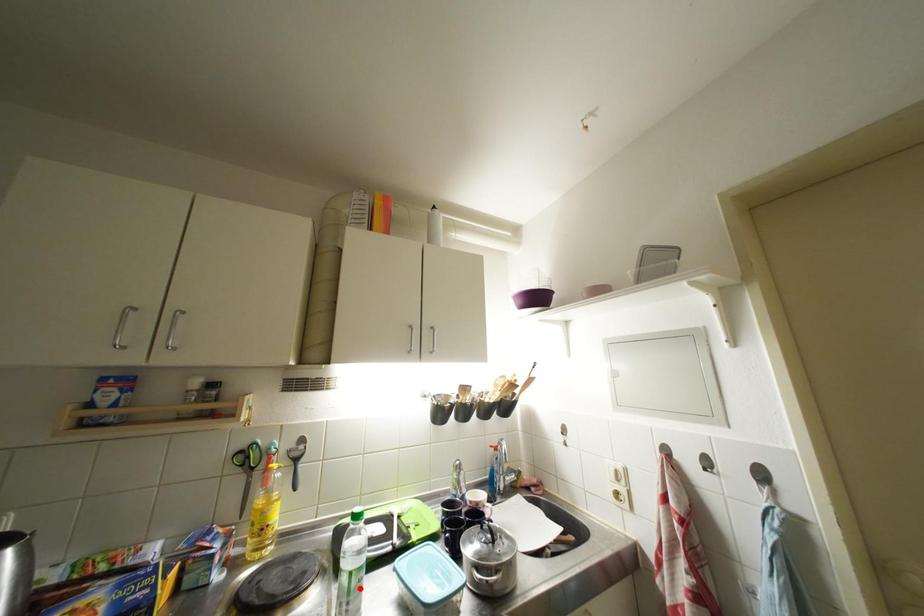
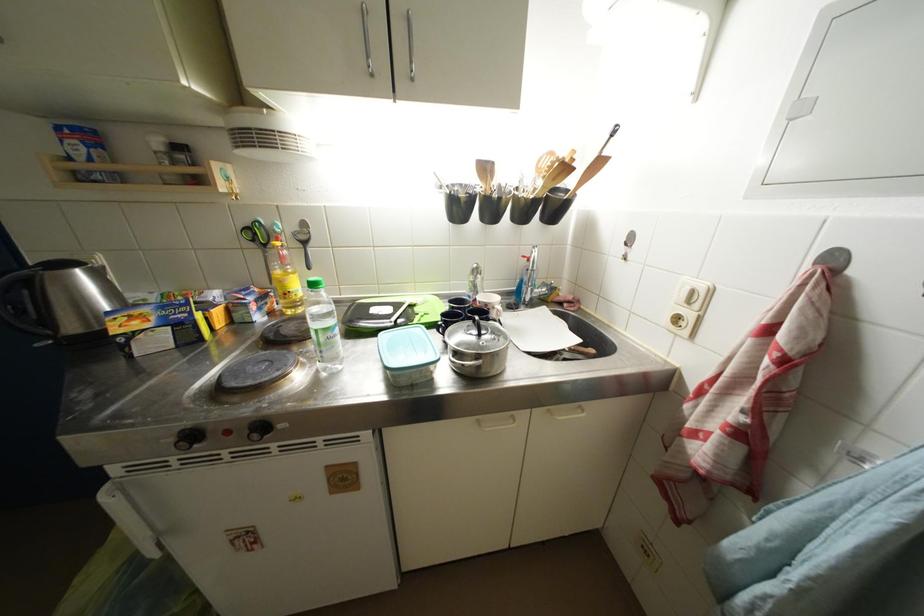
Find the pixel in the second image that matches the highlighted location in the first image.

(329, 344)